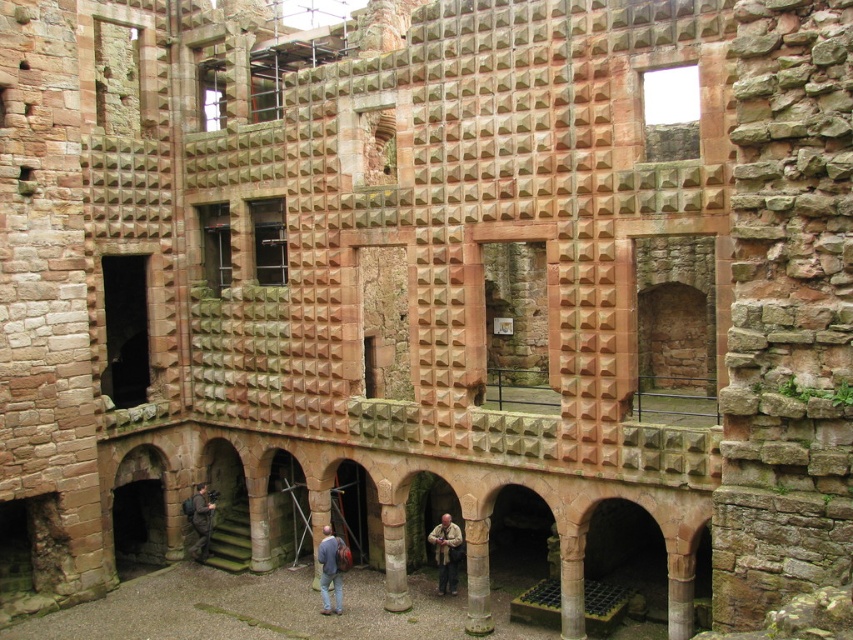
Question: Considering the relative positions of smooth stone column at center and brown textured jacket at lower center in the image provided, where is smooth stone column at center located with respect to brown textured jacket at lower center?

Choices:
 (A) left
 (B) right

Answer: (A)

Question: Among these points, which one is farthest from the camera?

Choices:
 (A) pyautogui.click(x=334, y=560)
 (B) pyautogui.click(x=450, y=525)
 (C) pyautogui.click(x=409, y=608)

Answer: (B)

Question: Is smooth stone column at center closer to camera compared to dark gray fabric jacket at lower center?

Choices:
 (A) no
 (B) yes

Answer: (B)

Question: Which point appears closest to the camera in this image?

Choices:
 (A) (389, 518)
 (B) (200, 492)
 (C) (344, 548)
 (D) (440, 524)

Answer: (A)

Question: From the image, what is the correct spatial relationship of smooth stone column at center in relation to blue denim jacket at lower center?

Choices:
 (A) right
 (B) left

Answer: (A)

Question: Estimate the real-world distances between objects in this image. Which object is closer to the smooth stone column at center?

Choices:
 (A) blue denim jacket at lower center
 (B) brown textured jacket at lower center
 (C) dark gray fabric jacket at lower center

Answer: (A)